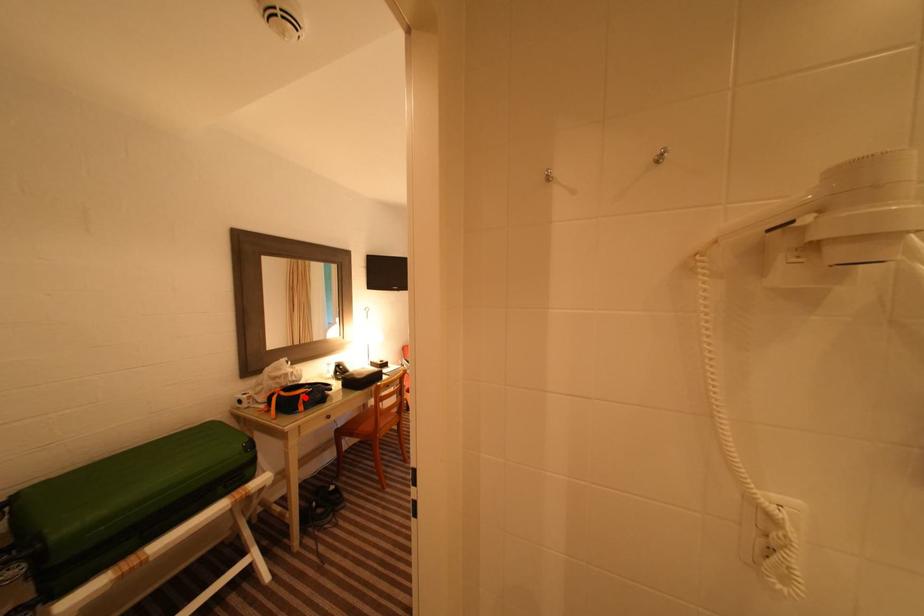
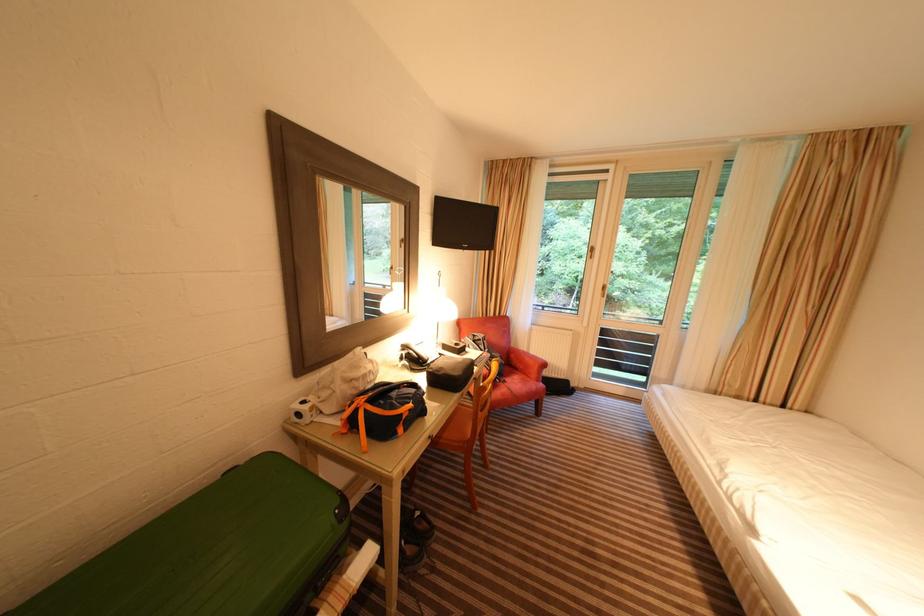
Locate, in the second image, the point that corresponds to the highlighted location in the first image.

(407, 416)